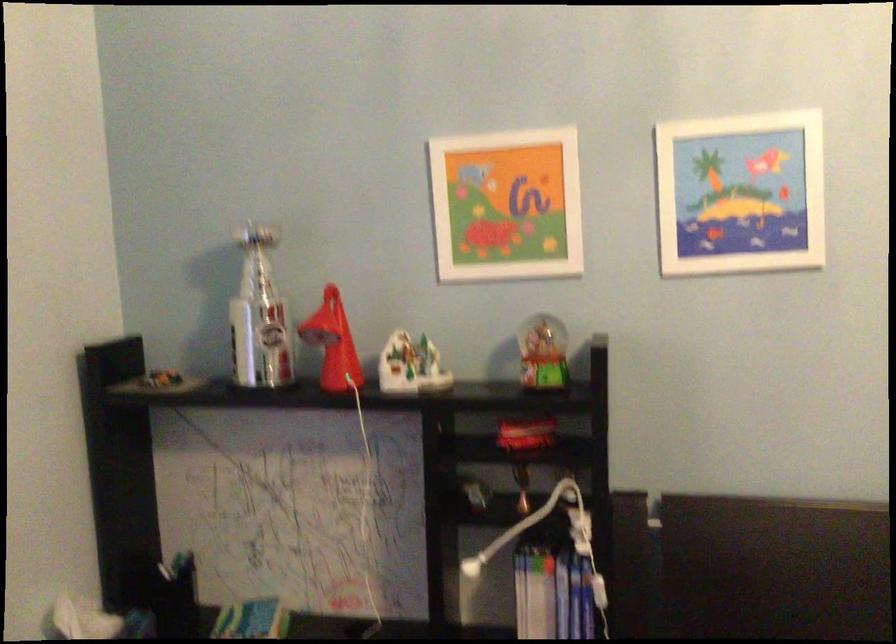
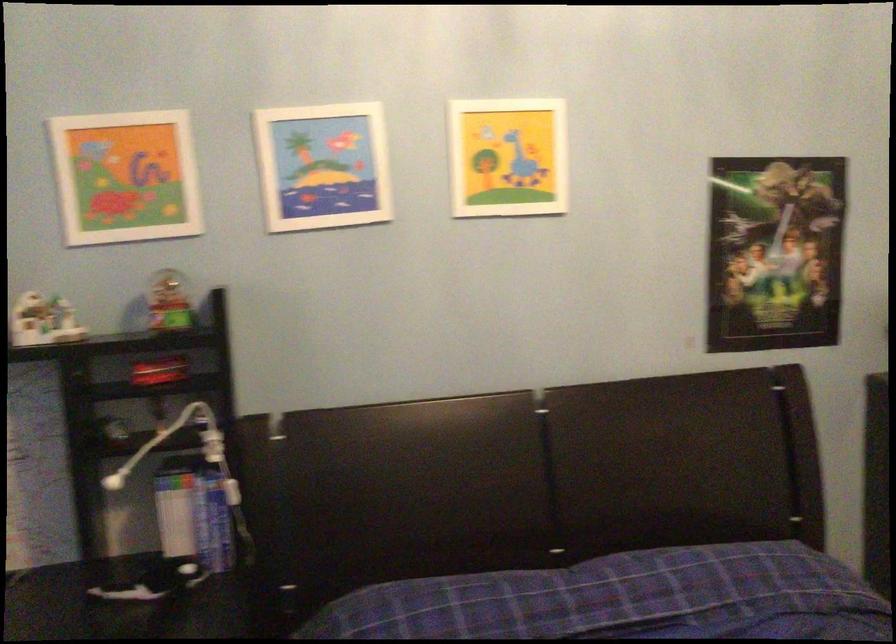
Question: In a continuous first-person perspective shot, in which direction is the camera moving?

Choices:
 (A) Left
 (B) Right
 (C) Forward
 (D) Backward

Answer: (D)